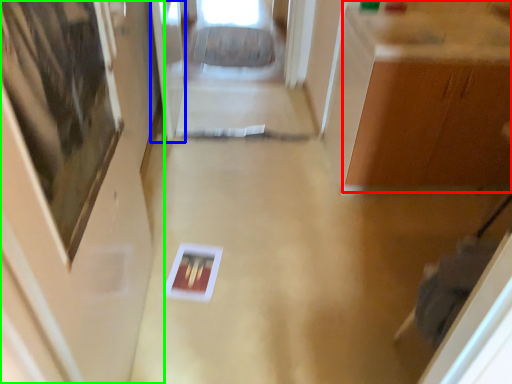
Question: Which object is positioned closest to cabinetry (highlighted by a red box)? Select from glass door (highlighted by a blue box) and door (highlighted by a green box).

Choices:
 (A) glass door
 (B) door

Answer: (B)